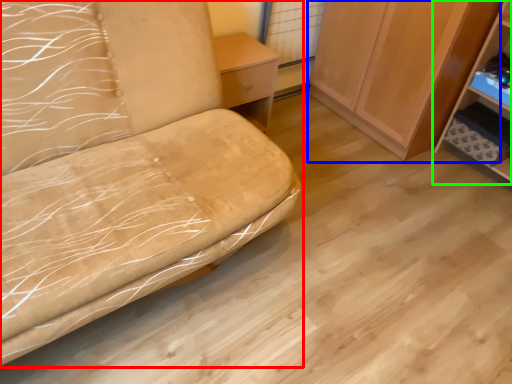
Question: Based on their relative distances, which object is farther from furniture (highlighted by a red box)? Choose from cabinetry (highlighted by a blue box) and shelf (highlighted by a green box).

Choices:
 (A) cabinetry
 (B) shelf

Answer: (B)